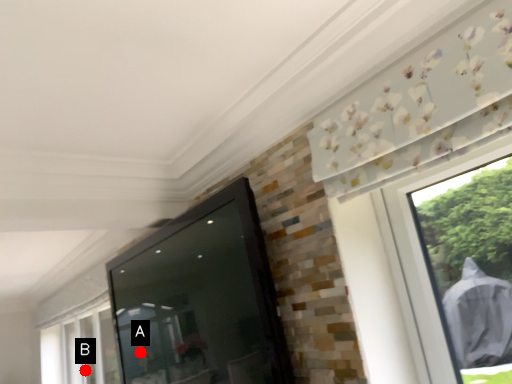
Question: Two points are circled on the image, labeled by A and B beside each circle. Which point is further to the camera?

Choices:
 (A) A is further
 (B) B is further

Answer: (B)